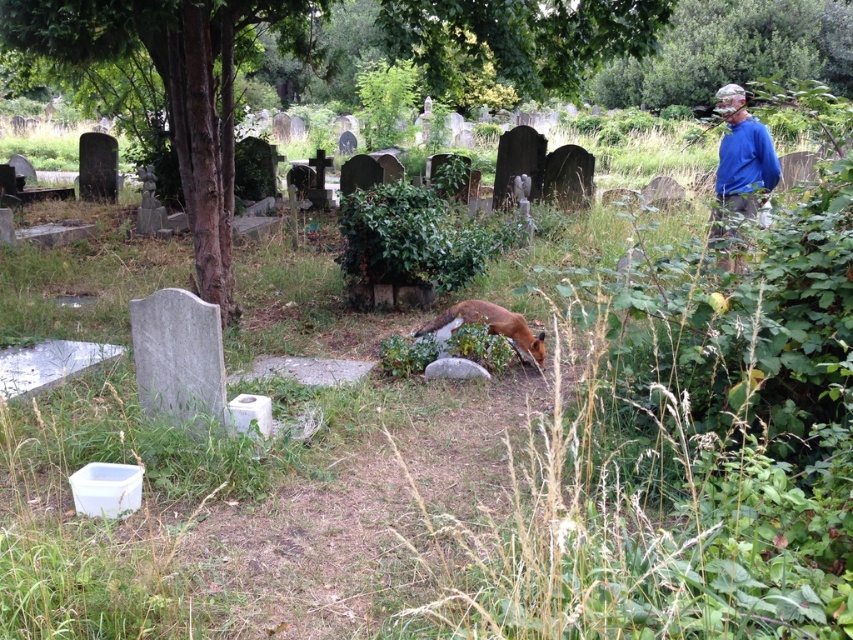
You are a photographer trying to capture a clear shot of the blue cotton shirt at upper right. There is a green leafy tree at upper right in the way. Can you tell whether the tree is blocking the shirt?

The green leafy tree at upper right might be wider than blue cotton shirt at upper right, so it could be blocking the shirt depending on their positions.

You are standing in the cemetery and want to place a new tombstone between the brown textured tree at center and the blue cotton shirt at upper right. Which object should you position the tombstone closer to if you want it to be closer to the tree?

You should position the tombstone closer to the brown textured tree at center because it is already closer to the viewer than the blue cotton shirt at upper right.

You are a visitor at this cemetery and notice both the green leafy tree at upper right and the blue cotton shirt at upper right. Which object is bigger in size?

The green leafy tree at upper right is larger in size than the blue cotton shirt at upper right.